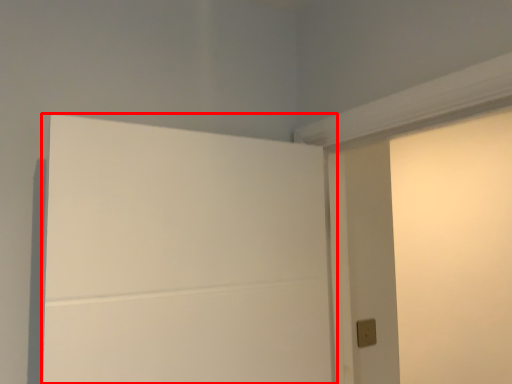
Question: From the image's perspective, what is the correct spatial positioning of door (annotated by the red box) in reference to light switch?

Choices:
 (A) above
 (B) below

Answer: (A)